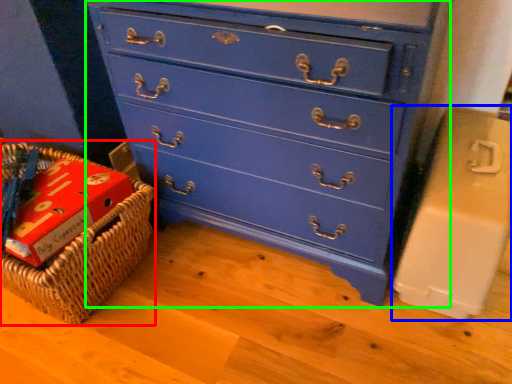
Question: Based on their relative distances, which object is farther from basket (highlighted by a red box)? Choose from cardboard box (highlighted by a blue box) and chest of drawers (highlighted by a green box).

Choices:
 (A) cardboard box
 (B) chest of drawers

Answer: (A)